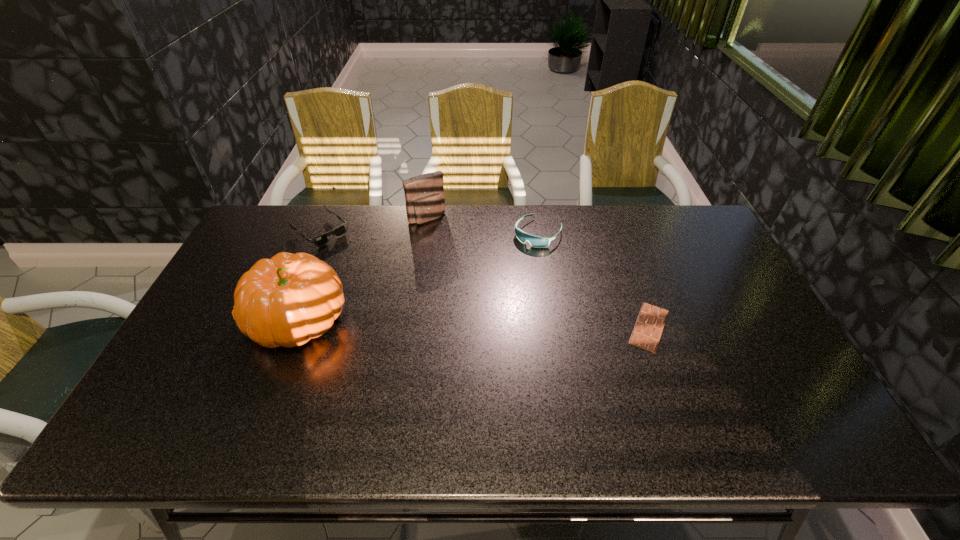
Locate an element on the screen. pumpkin is located at coordinates (287, 300).

Where is `the shortest object`? This screenshot has height=540, width=960. the shortest object is located at coordinates (648, 328).

This screenshot has width=960, height=540. In order to click on the rightmost object in this screenshot , I will do `click(648, 328)`.

The image size is (960, 540). In order to click on the fourth object from left to right in this screenshot , I will do `click(535, 241)`.

Where is `the third shortest object`? This screenshot has height=540, width=960. the third shortest object is located at coordinates (535, 241).

You are a GUI agent. You are given a task and a screenshot of the screen. Output one action in this format:
    pyautogui.click(x=<x>, y=<y>)
    Task: Click on the second shortest object
    Image resolution: width=960 pixels, height=540 pixels.
    Given the screenshot: What is the action you would take?
    pyautogui.click(x=339, y=231)

This screenshot has height=540, width=960. I want to click on the fourth shortest object, so click(424, 194).

Image resolution: width=960 pixels, height=540 pixels. I want to click on pouch, so click(x=424, y=194).

Where is `free space located on the carved face of the pumpkin`? free space located on the carved face of the pumpkin is located at coordinates (203, 319).

The height and width of the screenshot is (540, 960). I want to click on vacant space located on the carved face of the pumpkin, so click(x=230, y=319).